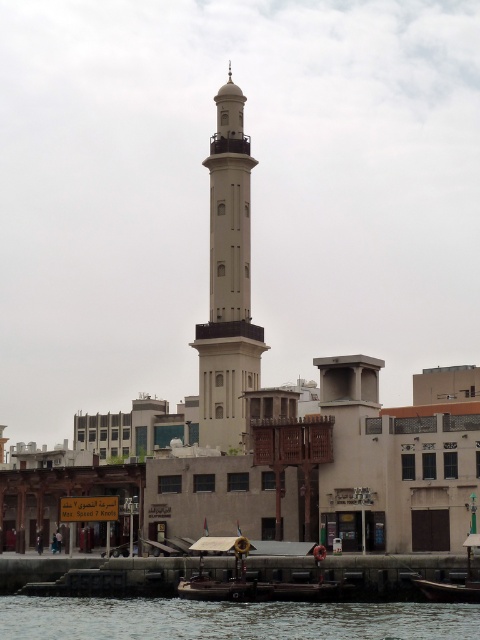
Question: Can you confirm if white smooth minaret at center is positioned to the left of wooden boat at lower right?

Choices:
 (A) no
 (B) yes

Answer: (B)

Question: Considering the relative positions of dark blue water at lower center and white smooth minaret at center in the image provided, where is dark blue water at lower center located with respect to white smooth minaret at center?

Choices:
 (A) left
 (B) right

Answer: (A)

Question: Estimate the real-world distances between objects in this image. Which object is farther from the dark blue water at lower center?

Choices:
 (A) wooden boat at lower right
 (B) white smooth minaret at center

Answer: (B)

Question: Among these objects, which one is farthest from the camera?

Choices:
 (A) dark blue water at lower center
 (B) wooden boat at lower right

Answer: (B)

Question: Observing the image, what is the correct spatial positioning of white smooth minaret at center in reference to wooden boat at lower right?

Choices:
 (A) right
 (B) left

Answer: (B)

Question: Which object appears closest to the camera in this image?

Choices:
 (A) dark blue water at lower center
 (B) wooden boat at lower right

Answer: (A)